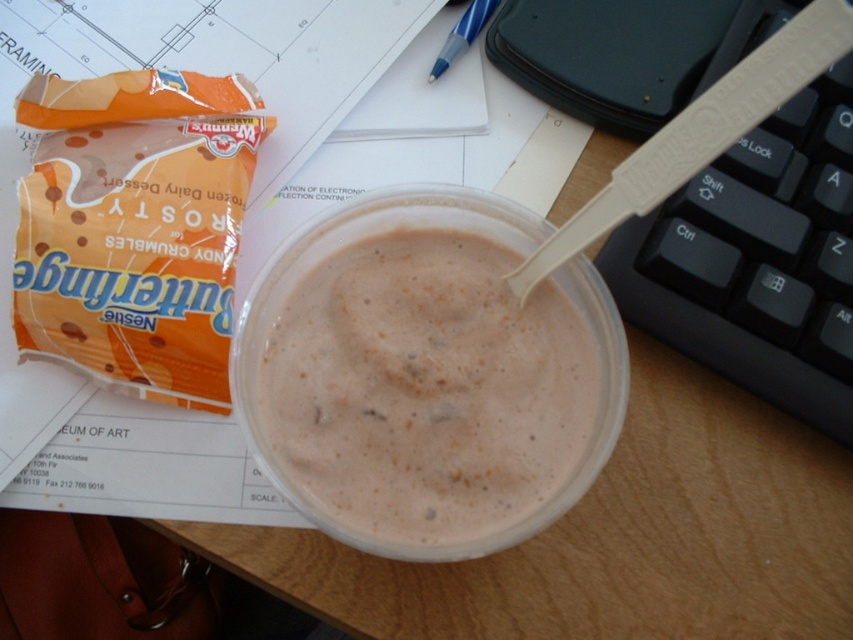
Question: Does white creamy pudding at center have a greater width compared to blue plastic pen at upper center?

Choices:
 (A) yes
 (B) no

Answer: (A)

Question: Is white creamy pudding at center thinner than blue plastic pen at upper center?

Choices:
 (A) yes
 (B) no

Answer: (B)

Question: Which object appears closest to the camera in this image?

Choices:
 (A) white creamy pudding at center
 (B) blue plastic pen at upper center

Answer: (A)

Question: Can you confirm if white creamy pudding at center is wider than blue plastic pen at upper center?

Choices:
 (A) no
 (B) yes

Answer: (B)